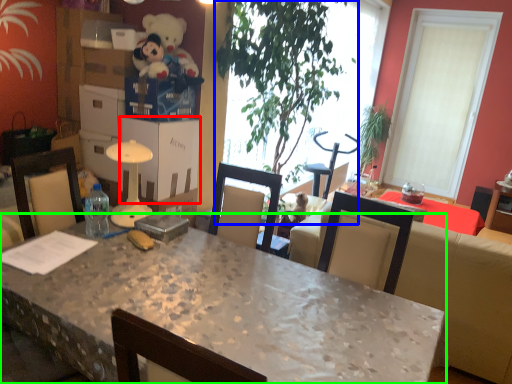
Question: Based on their relative distances, which object is nearer to cardboard box (highlighted by a red box)? Choose from houseplant (highlighted by a blue box) and desk (highlighted by a green box).

Choices:
 (A) houseplant
 (B) desk

Answer: (A)